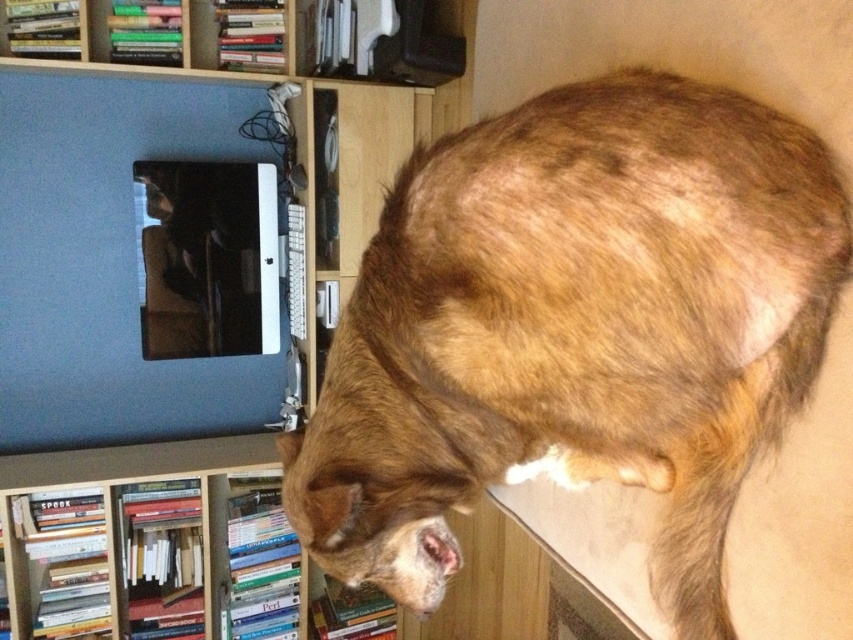
You are organizing a study area and need to place both the wooden bookshelf at lower left and the matte blue monitor at upper left. Based on their sizes, which object should you place first to ensure there is enough space for both?

The wooden bookshelf at lower left has a smaller size compared to matte blue monitor at upper left, so you should place the matte blue monitor at upper left first to accommodate its larger size before arranging the smaller wooden bookshelf at lower left.

You are standing in front of the bookshelf and want to place a small decoration between the two points, point (436, 532) and point (444, 90). Which point should you place it closer to in order for it to appear larger to someone viewing the scene from your position?

To make the decoration appear larger, place it closer to point (436, 532) since it is closer to the camera and objects closer to the camera appear larger.

You are an interior designer assessing the space in the image. The brown fur at upper right and the wooden bookshelf at lower left are both in the room. Which object takes up more area in the image?

The wooden bookshelf at lower left takes up more area in the image because the brown fur at upper right occupies less space than it.